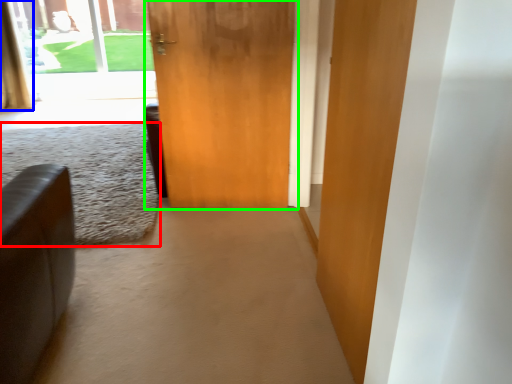
Question: Based on their relative distances, which object is nearer to plain (highlighted by a red box)? Choose from curtain (highlighted by a blue box) and door (highlighted by a green box).

Choices:
 (A) curtain
 (B) door

Answer: (B)